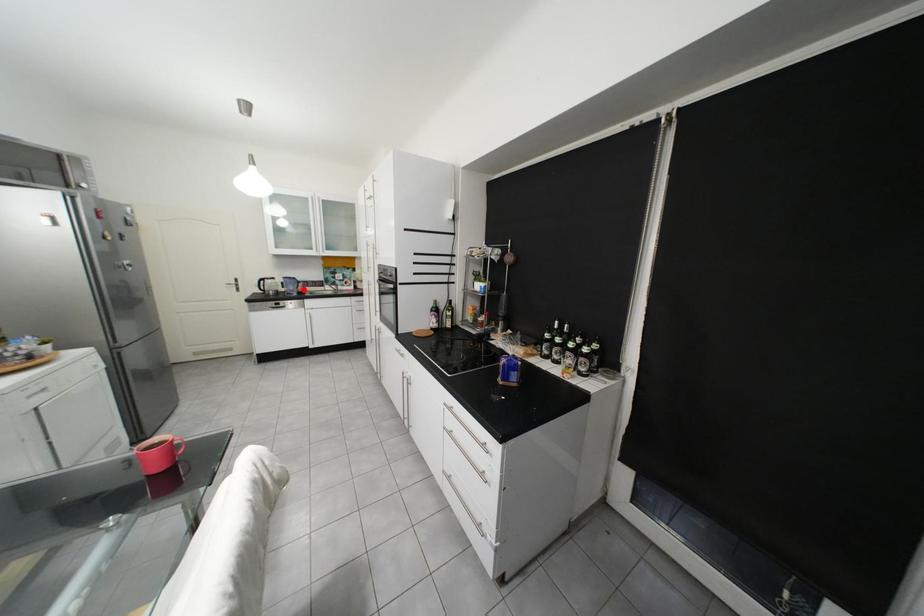
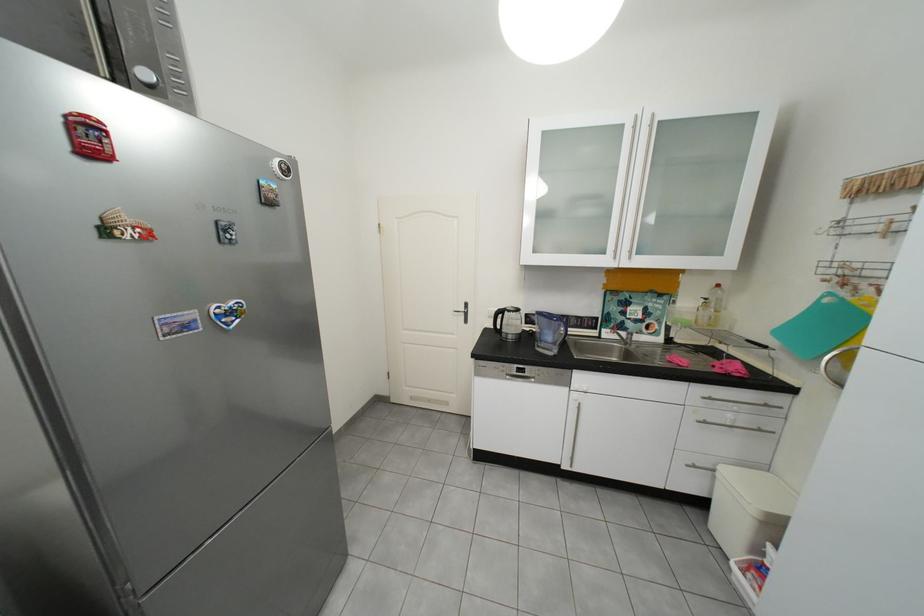
Locate, in the second image, the point that corresponds to the highlighted location in the first image.

(561, 339)